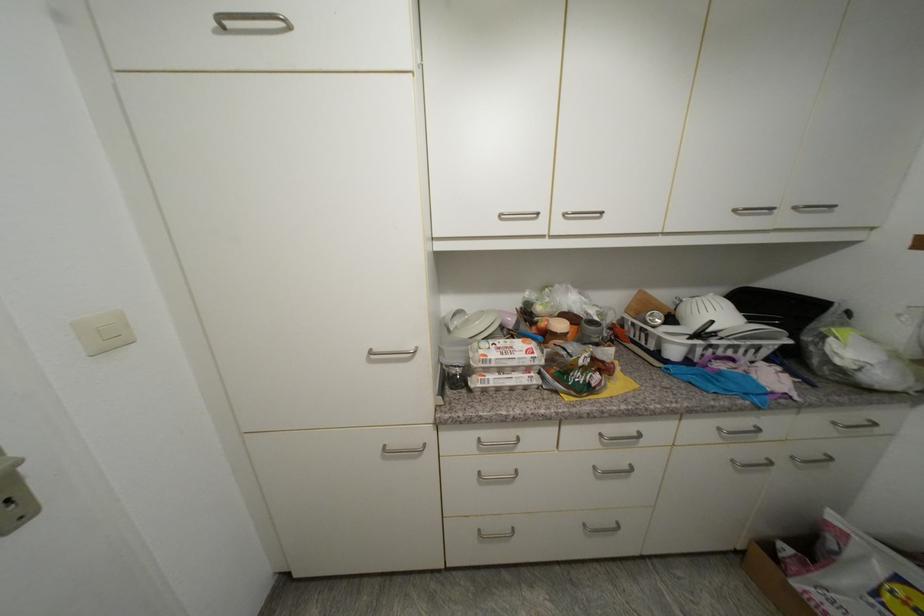
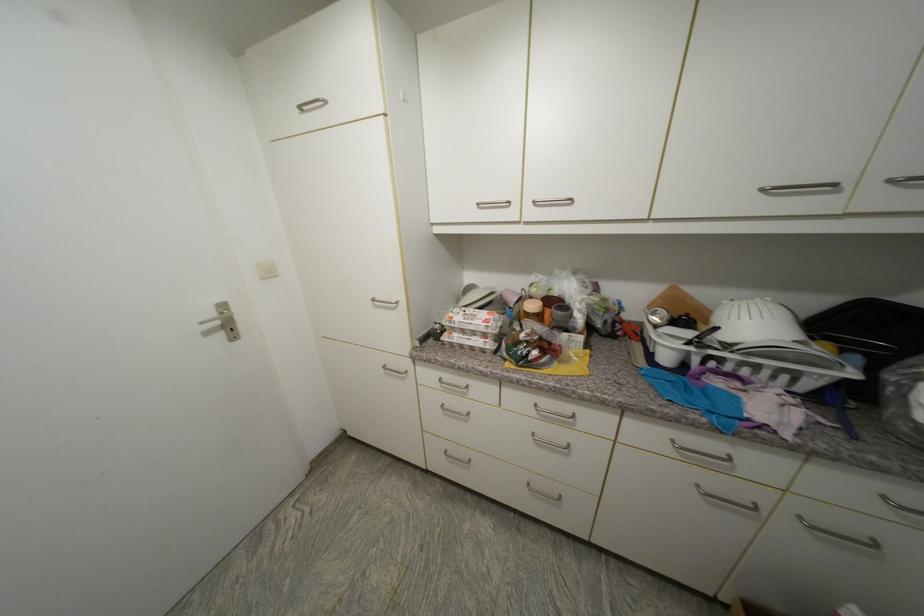
Question: The images are taken continuously from a first-person perspective. In which direction is your viewpoint rotating?

Choices:
 (A) Left
 (B) Right
 (C) Up
 (D) Down

Answer: (A)